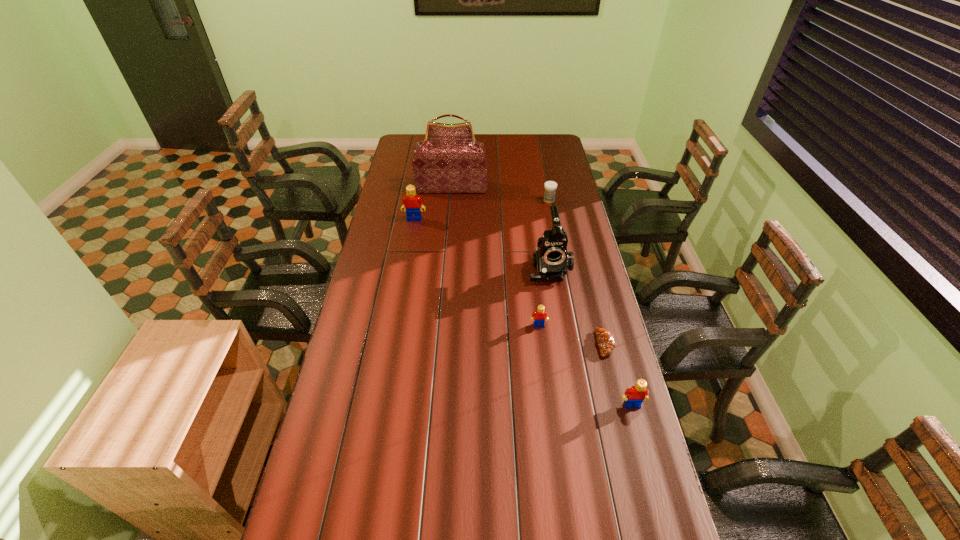
I want to click on the third farthest object, so click(411, 202).

Locate an element on the screen. The height and width of the screenshot is (540, 960). the farthest Lego is located at coordinates (411, 202).

Locate an element on the screen. Image resolution: width=960 pixels, height=540 pixels. the second Lego from left to right is located at coordinates (x=539, y=317).

This screenshot has height=540, width=960. In order to click on the fifth farthest object in this screenshot , I will do `click(539, 317)`.

Locate an element on the screen. The height and width of the screenshot is (540, 960). the second tallest Lego is located at coordinates (634, 396).

This screenshot has height=540, width=960. I want to click on the nearest object, so click(x=634, y=396).

Find the location of a particular element. handbag is located at coordinates (449, 160).

Locate an element on the screen. The image size is (960, 540). the tallest object is located at coordinates (449, 160).

I want to click on the sixth nearest object, so click(x=550, y=187).

The width and height of the screenshot is (960, 540). I want to click on camcorder, so click(x=551, y=260).